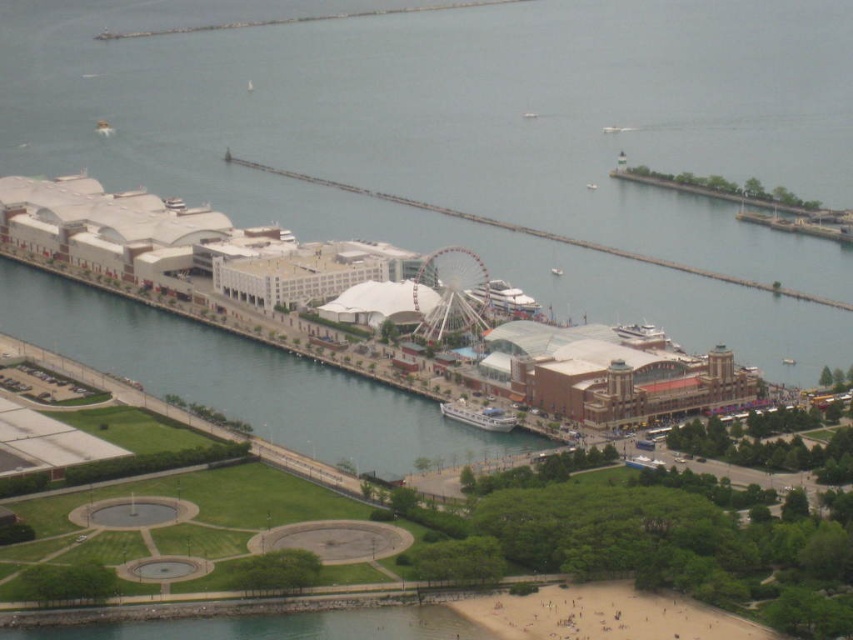
In the scene shown: Is green grass at lower center closer to the viewer compared to white metallic ferris wheel at center?

No.

Between green grass at lower center and white metallic ferris wheel at center, which one has less height?

white metallic ferris wheel at center is shorter.

Does point (73, 145) come closer to viewer compared to point (477, 284)?

No, it is behind (477, 284).

At what (x,y) coordinates should I click in order to perform the action: click on green grass at lower center. Please return your answer as a coordinate pair (x, y). This screenshot has height=640, width=853. Looking at the image, I should click on (479, 140).

Can you confirm if green concrete river at center is positioned to the left of white metallic ferris wheel at center?

Correct, you'll find green concrete river at center to the left of white metallic ferris wheel at center.

Is point (419, 452) positioned after point (428, 273)?

That is True.

Between point (102, 312) and point (421, 307), which one is positioned in front?

Point (421, 307) is in front.

What are the coordinates of `green concrete river at center` in the screenshot? It's located at (242, 378).

Does green grass at lower center lie in front of green concrete river at center?

That is False.

Is green grass at lower center below green concrete river at center?

No, green grass at lower center is not below green concrete river at center.

Image resolution: width=853 pixels, height=640 pixels. What are the coordinates of `green grass at lower center` in the screenshot? It's located at (479, 140).

Where is `green grass at lower center`? The image size is (853, 640). green grass at lower center is located at coordinates (479, 140).